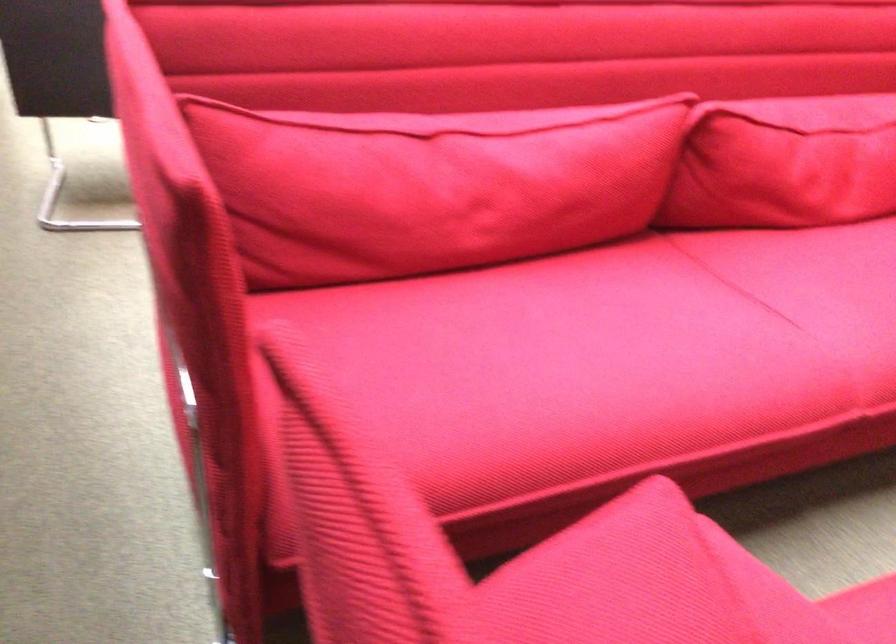
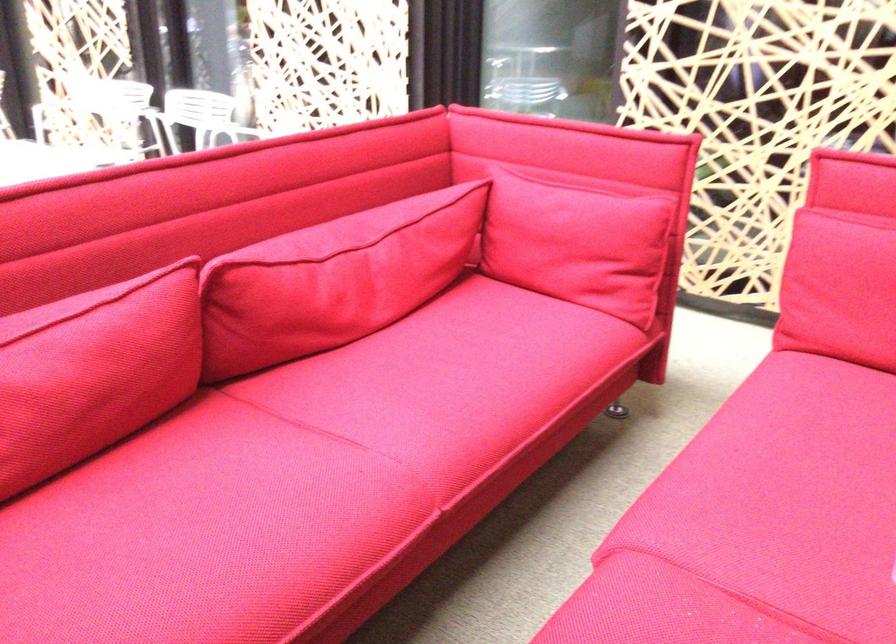
Find the pixel in the second image that matches (820,155) in the first image.

(332, 279)